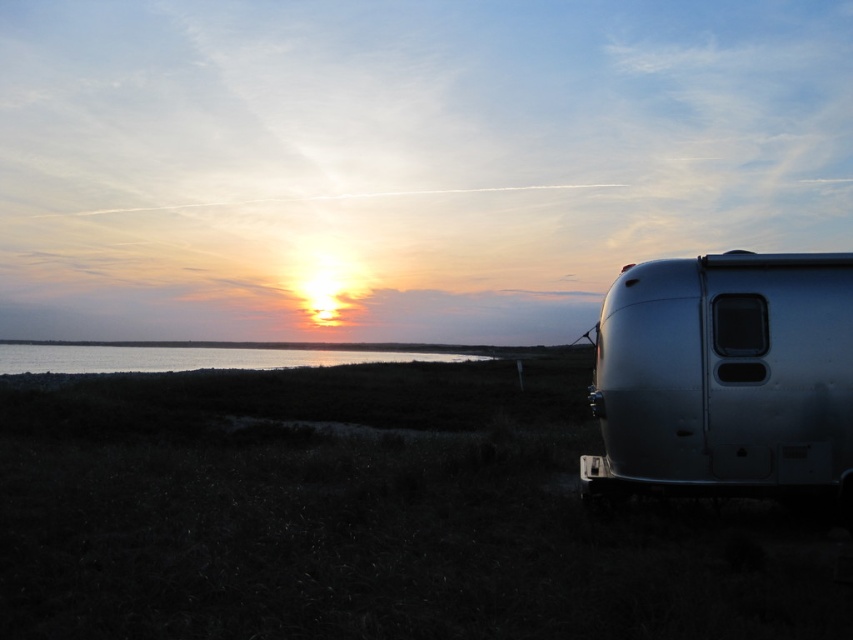
You are standing in the sunset scene and want to take a photo of both the point at coordinates point (819, 360) and point (79, 368). Since you want both points to be in focus, which point should you focus on to ensure both are sharp?

You should focus on point (819, 360) because it is closer to the camera than point (79, 368). By focusing on the closer point, the farther point will still be within the depth of field and remain sharp.

You are a photographer trying to capture the sunset scene. You want to ensure the silver metallic trailer at right and the silvery reflective water at lower left are both visible in your shot. Based on their positions, which object will appear higher in the photo?

The silver metallic trailer at right is located above the silvery reflective water at lower left, so it will appear higher in the photo.

You are standing at the point marked by point (726, 378) in the image. What object are you directly facing?

You are directly facing the silver metallic trailer at right as the point marks its location.